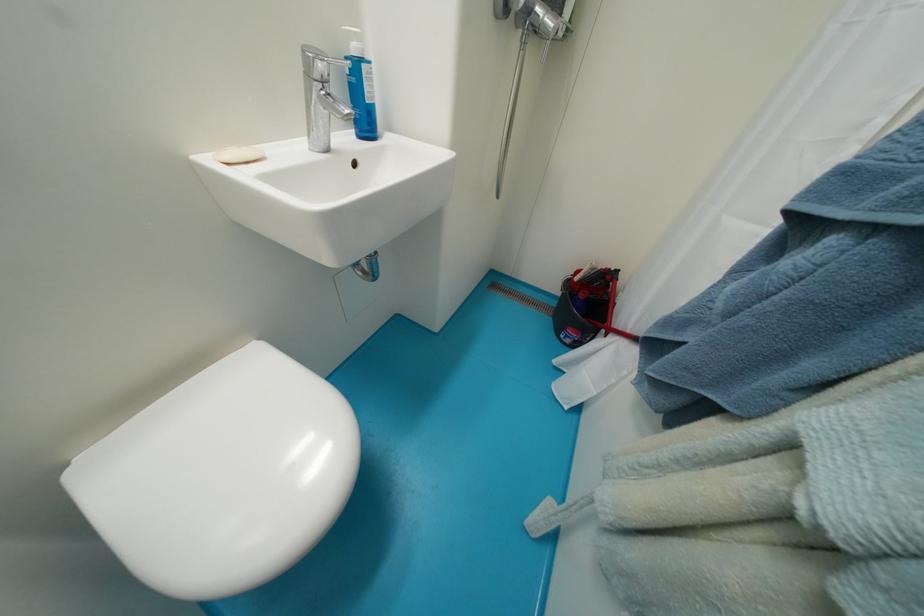
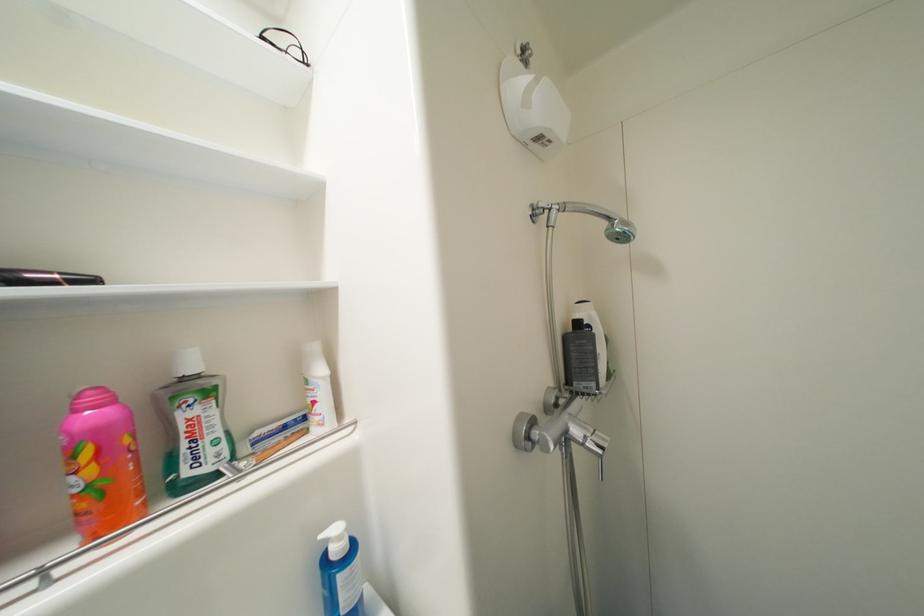
First-person continuous shooting, in which direction is the camera rotating?

The camera's rotation is toward left-up.